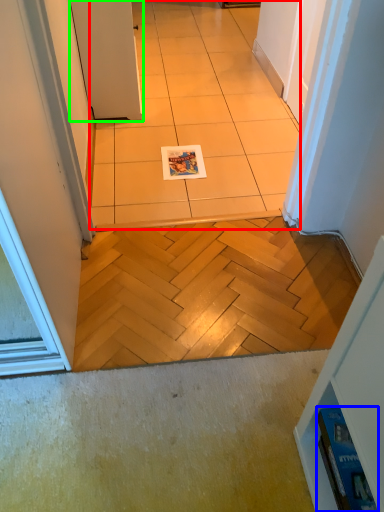
Question: Which object is the closest to the ceramic tile (highlighted by a red box)? Choose among these: magazine (highlighted by a blue box) or door (highlighted by a green box).

Choices:
 (A) magazine
 (B) door

Answer: (B)